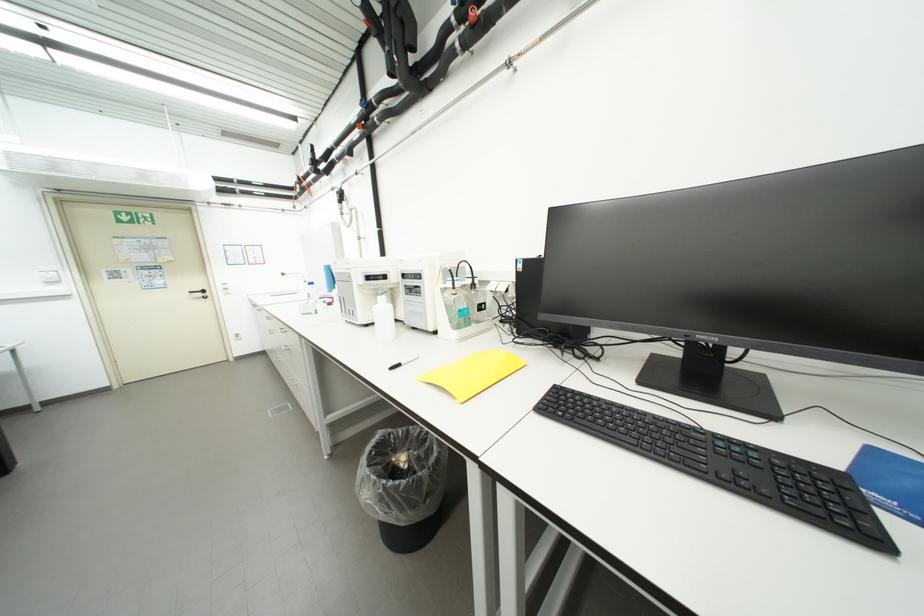
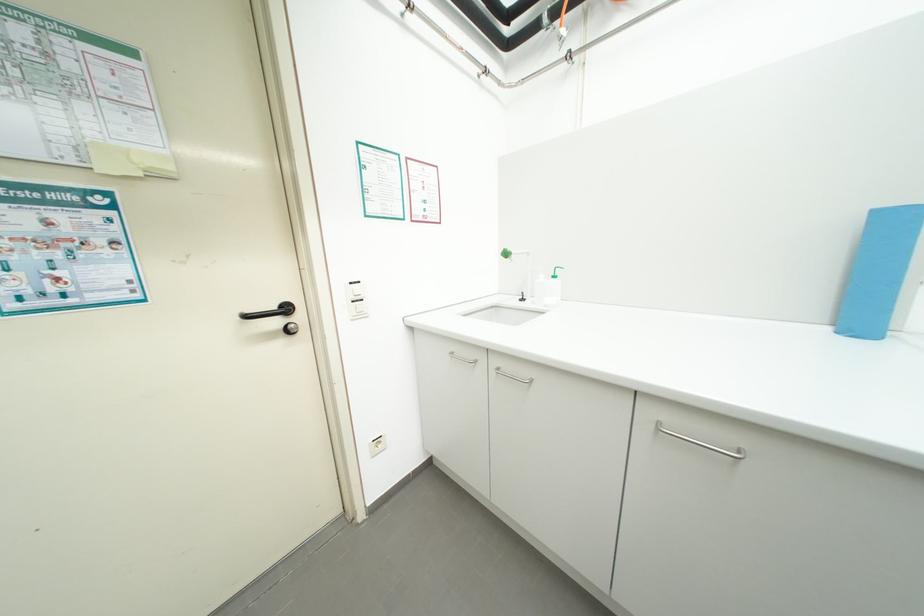
The images are taken continuously from a first-person perspective. In which direction are you moving?

The cameraman moved toward left, forward.